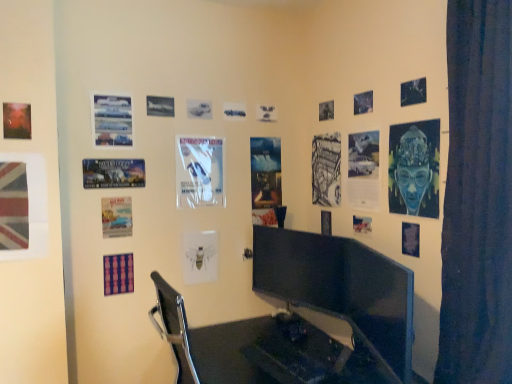
Measure the distance between point (257,106) and camera.

The distance of point (257,106) from camera is 2.54 meters.

Measure the distance between white glossy poster at center, acting as the 9th poster page starting from the left, and camera.

The depth of white glossy poster at center, acting as the 9th poster page starting from the left, is 7.71 feet.

The image size is (512, 384). Describe the element at coordinates (113, 173) in the screenshot. I see `metallic poster at left, the fourteenth poster page positioned from the right` at that location.

In order to face blue paper at lower right, the 1th poster page viewed from the right, should I rotate leftwards or rightwards?

A 19.927 degree turn to the right will do.

The image size is (512, 384). What do you see at coordinates (362, 170) in the screenshot?
I see `matte paper poster at upper right, the fourth poster page when ordered from right to left` at bounding box center [362, 170].

Describe the element at coordinates (28, 203) in the screenshot. This screenshot has width=512, height=384. I see `union jack flag at left, acting as the seventeenth poster page starting from the right` at that location.

Locate an element on the screen. This screenshot has height=384, width=512. glossy plastic poster at upper center, the seventh poster page from the right is located at coordinates (266, 113).

From their relative heights in the image, would you say metallic blue cars at upper left, positioned as the third poster page in left-to-right order, is taller or shorter than metallic poster at left, the fourteenth poster page positioned from the right?

In the image, metallic blue cars at upper left, positioned as the third poster page in left-to-right order, appears to be taller than metallic poster at left, the fourteenth poster page positioned from the right.

Does point (95, 144) lie behind point (97, 172)?

No.

Is metallic blue cars at upper left, positioned as the third poster page in left-to-right order, inside or outside of metallic poster at left, the fourteenth poster page positioned from the right?

metallic blue cars at upper left, positioned as the third poster page in left-to-right order, exists outside the volume of metallic poster at left, the fourteenth poster page positioned from the right.

Considering the relative positions of metallic blue cars at upper left, which appears as the fifteenth poster page when viewed from the right, and metallic poster at left, which is the fourth poster page from left to right, in the image provided, is metallic blue cars at upper left, which appears as the fifteenth poster page when viewed from the right, in front of metallic poster at left, which is the fourth poster page from left to right,?

No, metallic blue cars at upper left, which appears as the fifteenth poster page when viewed from the right, is further to the viewer.

Is black glossy monitor at center, which appears as the 1th computer monitor when viewed from the left, located within metallic blue cars at upper left, which appears as the fifteenth poster page when viewed from the right?

Actually, black glossy monitor at center, which appears as the 1th computer monitor when viewed from the left, is outside metallic blue cars at upper left, which appears as the fifteenth poster page when viewed from the right.

From a real-world perspective, is metallic blue cars at upper left, which appears as the fifteenth poster page when viewed from the right, over black glossy monitor at center, which appears as the 1th computer monitor when viewed from the left?

Correct, in the physical world, metallic blue cars at upper left, which appears as the fifteenth poster page when viewed from the right, is higher than black glossy monitor at center, which appears as the 1th computer monitor when viewed from the left.

Is black glossy monitor at center, which appears as the second computer monitor when viewed from the right, at the back of metallic blue cars at upper left, which appears as the fifteenth poster page when viewed from the right?

metallic blue cars at upper left, which appears as the fifteenth poster page when viewed from the right, does not have its back to black glossy monitor at center, which appears as the second computer monitor when viewed from the right.

From their relative heights in the image, would you say metallic blue cars at upper left, which appears as the fifteenth poster page when viewed from the right, is taller or shorter than black glossy monitor at center, which appears as the 1th computer monitor when viewed from the left?

metallic blue cars at upper left, which appears as the fifteenth poster page when viewed from the right, is shorter than black glossy monitor at center, which appears as the 1th computer monitor when viewed from the left.

Is metallic silver poster at upper right, marked as the 3th poster page in a right-to-left arrangement, surrounded by metallic poster at left, which is the fourth poster page from left to right?

No, metallic silver poster at upper right, marked as the 3th poster page in a right-to-left arrangement, is not inside metallic poster at left, which is the fourth poster page from left to right.

From a real-world perspective, which is physically below, metallic poster at left, which is the fourth poster page from left to right, or metallic silver poster at upper right, acting as the 15th poster page starting from the left?

metallic poster at left, which is the fourth poster page from left to right, is physically lower.

Does matte paper poster at lower left, arranged as the thirteenth poster page when viewed from the right, lie behind purple fabric poster at lower left, which appears as the sixth poster page when viewed from the left?

That is False.

Is matte paper poster at lower left, which appears as the 5th poster page when viewed from the left, taller or shorter than purple fabric poster at lower left, which appears as the sixth poster page when viewed from the left?

matte paper poster at lower left, which appears as the 5th poster page when viewed from the left, is taller than purple fabric poster at lower left, which appears as the sixth poster page when viewed from the left.

You are a GUI agent. You are given a task and a screenshot of the screen. Output one action in this format:
    pyautogui.click(x=<x>, y=<y>)
    Task: Click on the 3rd poster page positioned above the purple fabric poster at lower left, positioned as the twelfth poster page in right-to-left order (from the image's perspective)
    The height and width of the screenshot is (384, 512).
    Given the screenshot: What is the action you would take?
    pyautogui.click(x=116, y=217)

Are matte paper poster at lower left, arranged as the thirteenth poster page when viewed from the right, and purple fabric poster at lower left, which appears as the sixth poster page when viewed from the left, making contact?

matte paper poster at lower left, arranged as the thirteenth poster page when viewed from the right, is not next to purple fabric poster at lower left, which appears as the sixth poster page when viewed from the left, and they're not touching.

From the image's perspective, is metallic silver poster at upper right, the 5th poster page from the right, located beneath white glossy poster at center, which is counted as the 9th poster page, starting from the right?

No.

What's the angular difference between metallic silver poster at upper right, the 5th poster page from the right, and white glossy poster at center, which is counted as the 9th poster page, starting from the right,'s facing directions?

88.3 degrees separate the facing orientations of metallic silver poster at upper right, the 5th poster page from the right, and white glossy poster at center, which is counted as the 9th poster page, starting from the right.

Is metallic silver poster at upper right, positioned as the thirteenth poster page in left-to-right order, bigger or smaller than white glossy poster at center, acting as the 9th poster page starting from the left?

metallic silver poster at upper right, positioned as the thirteenth poster page in left-to-right order, is smaller than white glossy poster at center, acting as the 9th poster page starting from the left.

Choose the correct answer: Is metallic silver poster at upper right, the 5th poster page from the right, inside white glossy poster at center, acting as the 9th poster page starting from the left, or outside it?

metallic silver poster at upper right, the 5th poster page from the right, is not enclosed by white glossy poster at center, acting as the 9th poster page starting from the left.

Which object is thinner, dark blue fabric curtain at right or union jack flag at left, arranged as the 1th poster page when viewed from the left?

union jack flag at left, arranged as the 1th poster page when viewed from the left, is thinner.

How distant is dark blue fabric curtain at right from union jack flag at left, arranged as the 1th poster page when viewed from the left?

dark blue fabric curtain at right and union jack flag at left, arranged as the 1th poster page when viewed from the left, are 5.57 feet apart from each other.

Based on the photo, from the image's perspective, is dark blue fabric curtain at right located above union jack flag at left, acting as the seventeenth poster page starting from the right?

Correct, dark blue fabric curtain at right appears higher than union jack flag at left, acting as the seventeenth poster page starting from the right, in the image.

Consider the image. Which object is further away from the camera, dark blue fabric curtain at right or union jack flag at left, arranged as the 1th poster page when viewed from the left?

union jack flag at left, arranged as the 1th poster page when viewed from the left, is further away from the camera.

Which of these two, matte black monitor at center, which is the first computer monitor from right to left, or blue textured fabric at upper right, the sixteenth poster page positioned from the left, is bigger?

matte black monitor at center, which is the first computer monitor from right to left.

From a real-world perspective, which computer monitor is the 2nd one underneath the blue textured fabric at upper right, which is the second poster page from right to left? Please provide its 2D coordinates.

[(379, 303)]

Is point (411, 274) closer or farther from the camera than point (403, 154)?

Point (411, 274) is closer to the camera than point (403, 154).

How many degrees apart are the facing directions of matte black monitor at center, the 1th computer monitor positioned from the front, and blue textured fabric at upper right, which is the second poster page from right to left?

They differ by 20.3 degrees in their facing directions.

Locate an element on the screen. poster page that is the 6th one when counting upward from the metallic poster at left, the fourteenth poster page positioned from the right (from the image's perspective) is located at coordinates (112, 120).

Find the location of a particular element. computer monitor that is the 1st object directly below the metallic blue cars at upper left, positioned as the third poster page in left-to-right order (from a real-world perspective) is located at coordinates (301, 268).

Based on their spatial positions, is metallic blue cars at upper left, which appears as the fifteenth poster page when viewed from the right, or matte paper poster at lower left, which appears as the 5th poster page when viewed from the left, closer to metallic silver poster at upper right, positioned as the thirteenth poster page in left-to-right order?

metallic blue cars at upper left, which appears as the fifteenth poster page when viewed from the right, is closer to metallic silver poster at upper right, positioned as the thirteenth poster page in left-to-right order.

Looking at the image, which one is located further to union jack flag at left, arranged as the 1th poster page when viewed from the left, white glossy poster at center, acting as the 9th poster page starting from the left, or blue paper at lower right, positioned as the 17th poster page in left-to-right order?

blue paper at lower right, positioned as the 17th poster page in left-to-right order, is positioned further to the anchor union jack flag at left, arranged as the 1th poster page when viewed from the left.

Based on their spatial positions, is dark blue fabric curtain at right or matte paper poster at upper right, the 14th poster page in the left-to-right sequence, closer to metallic blue cars at upper left, which appears as the fifteenth poster page when viewed from the right?

The object closer to metallic blue cars at upper left, which appears as the fifteenth poster page when viewed from the right, is matte paper poster at upper right, the 14th poster page in the left-to-right sequence.

Considering their positions, is black glossy monitor at center, which appears as the second computer monitor when viewed from the right, positioned closer to black glossy table at lower center than glossy plastic poster at upper center, arranged as the 11th poster page when viewed from the left?

black glossy monitor at center, which appears as the second computer monitor when viewed from the right, is closer to black glossy table at lower center.

Which object lies further to the anchor point glossy plastic poster at upper center, arranged as the 11th poster page when viewed from the left, metallic silver poster at upper right, marked as the 3th poster page in a right-to-left arrangement, or black glossy table at lower center?

black glossy table at lower center is positioned further to the anchor glossy plastic poster at upper center, arranged as the 11th poster page when viewed from the left.

Looking at this image, looking at the image, which one is located closer to blue textured fabric at upper right, the sixteenth poster page positioned from the left, metallic silver poster at upper right, marked as the 3th poster page in a right-to-left arrangement, or union jack flag at left, arranged as the 1th poster page when viewed from the left?

metallic silver poster at upper right, marked as the 3th poster page in a right-to-left arrangement, is closer to blue textured fabric at upper right, the sixteenth poster page positioned from the left.

Consider the image. Looking at the image, which one is located further to metallic silver poster at upper right, the 5th poster page from the right, white glossy poster at center, which is counted as the 9th poster page, starting from the right, or black glossy table at lower center?

Based on the image, black glossy table at lower center appears to be further to metallic silver poster at upper right, the 5th poster page from the right.

Estimate the real-world distances between objects in this image. Which object is closer to metallic silver poster at upper right, marked as the 3th poster page in a right-to-left arrangement, matte paper poster at upper right, the 14th poster page in the left-to-right sequence, or dark blue fabric curtain at right?

The object closer to metallic silver poster at upper right, marked as the 3th poster page in a right-to-left arrangement, is matte paper poster at upper right, the 14th poster page in the left-to-right sequence.

Locate an element on the screen. Image resolution: width=512 pixels, height=384 pixels. table between purple fabric poster at lower left, which appears as the sixth poster page when viewed from the left, and dark blue fabric curtain at right, in the horizontal direction is located at coordinates (275, 354).

Identify the location of curtain between metallic silver poster at upper right, marked as the 3th poster page in a right-to-left arrangement, and matte black monitor at center, which appears as the 2th computer monitor when viewed from the back, from top to bottom. The image size is (512, 384). (477, 198).

This screenshot has height=384, width=512. Identify the location of curtain that lies between matte paper poster at upper right, the fourth poster page when ordered from right to left, and black glossy table at lower center from top to bottom. (477, 198).

In order to click on table between metallic poster at left, which is the fourth poster page from left to right, and dark blue fabric curtain at right, in the horizontal direction in this screenshot , I will do `click(275, 354)`.